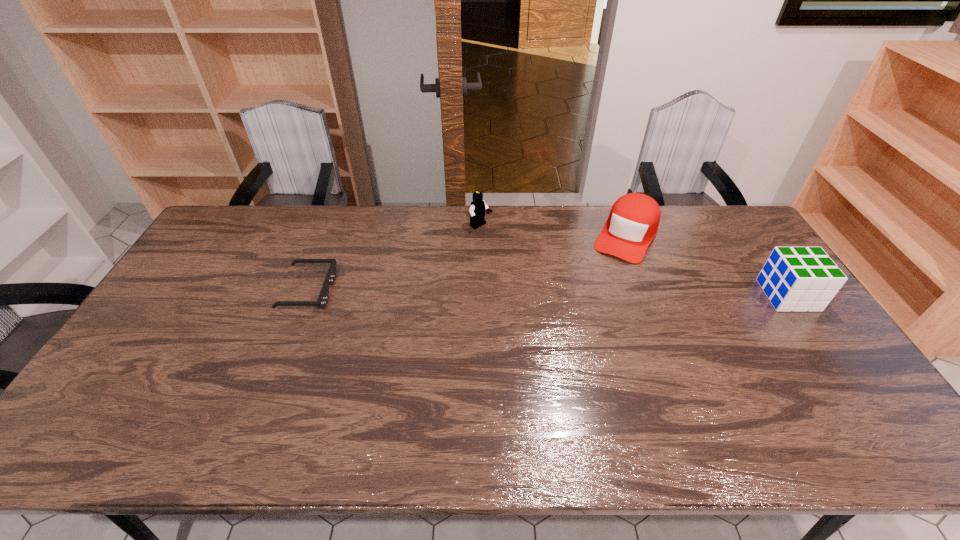
Locate an element on the screen. vacant region between the leftmost object and the rightmost object is located at coordinates pyautogui.click(x=548, y=293).

Identify the location of free spot between the baseball cap and the cube. The width and height of the screenshot is (960, 540). (707, 266).

At what (x,y) coordinates should I click in order to perform the action: click on empty location between the third object from left to right and the Lego. Please return your answer as a coordinate pair (x, y). The width and height of the screenshot is (960, 540). Looking at the image, I should click on (553, 231).

Find the location of `empty space between the second object from right to left and the rightmost object`. empty space between the second object from right to left and the rightmost object is located at coordinates (707, 266).

Where is `free space between the Lego and the baseball cap`? This screenshot has width=960, height=540. free space between the Lego and the baseball cap is located at coordinates (553, 231).

The height and width of the screenshot is (540, 960). I want to click on vacant area that lies between the third object from right to left and the sunglasses, so click(x=395, y=259).

Image resolution: width=960 pixels, height=540 pixels. I want to click on object that can be found as the third closest to the Lego, so 799,279.

Locate which object is the closest to the baseball cap. Please provide its 2D coordinates. Your answer should be formatted as a tuple, i.e. [(x, y)], where the tuple contains the x and y coordinates of a point satisfying the conditions above.

[(799, 279)]

The height and width of the screenshot is (540, 960). I want to click on vacant space that satisfies the following two spatial constraints: 1. on the front side of the rightmost object; 2. on the red face of the third object from right to left, so click(x=481, y=295).

Identify the location of vacant position in the image that satisfies the following two spatial constraints: 1. on the front side of the baseball cap; 2. on the left side of the second object from left to right. This screenshot has width=960, height=540. (481, 236).